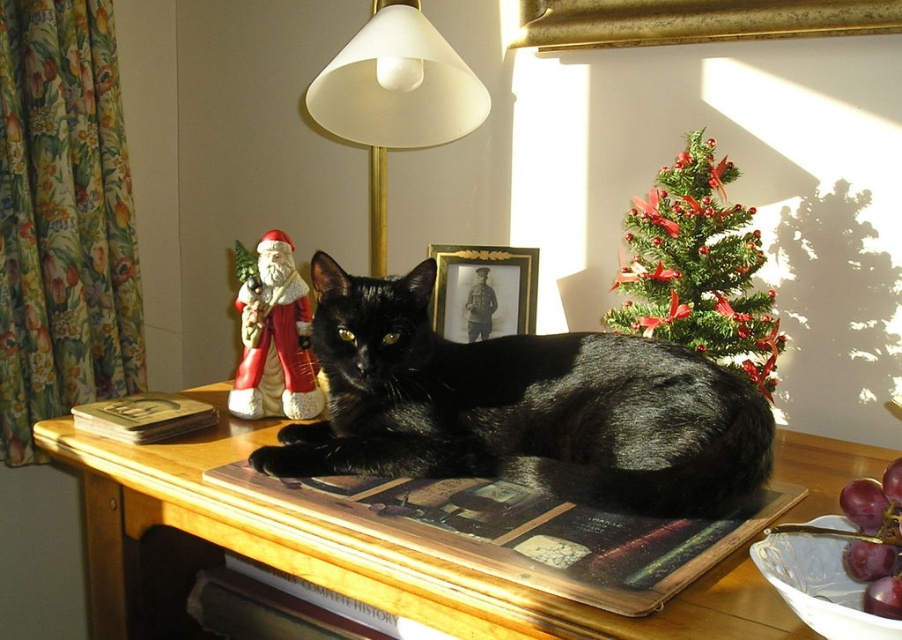
Question: Can you confirm if green textured christmas tree at upper right is positioned above white matte lampshade at upper center?

Choices:
 (A) yes
 (B) no

Answer: (B)

Question: Based on their relative distances, which object is farther from the gold metallic picture frame at center?

Choices:
 (A) glossy purple grapes at lower right
 (B) shiny black cat at center

Answer: (A)

Question: Which point appears closest to the camera in this image?

Choices:
 (A) (707, 300)
 (B) (737, 625)
 (C) (302, 456)
 (D) (870, 528)

Answer: (D)

Question: Where is green textured christmas tree at upper right located in relation to glossy purple grapes at lower right in the image?

Choices:
 (A) right
 (B) left

Answer: (A)

Question: Which point appears closest to the camera in this image?

Choices:
 (A) (394, 45)
 (B) (896, 525)
 (C) (514, 490)
 (D) (350, 531)

Answer: (B)

Question: Is shiny black cat at center closer to camera compared to white matte lampshade at upper center?

Choices:
 (A) yes
 (B) no

Answer: (A)